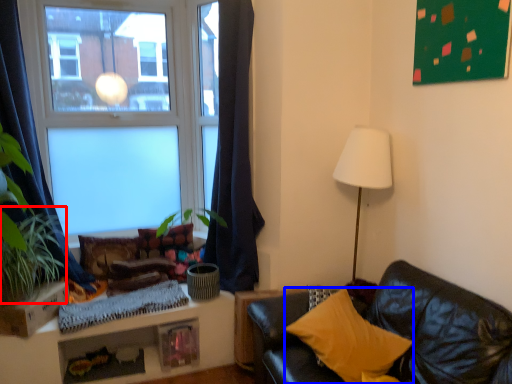
Question: Which point is closer to the camera, plant (highlighted by a red box) or pillow (highlighted by a blue box)?

Choices:
 (A) plant
 (B) pillow

Answer: (B)